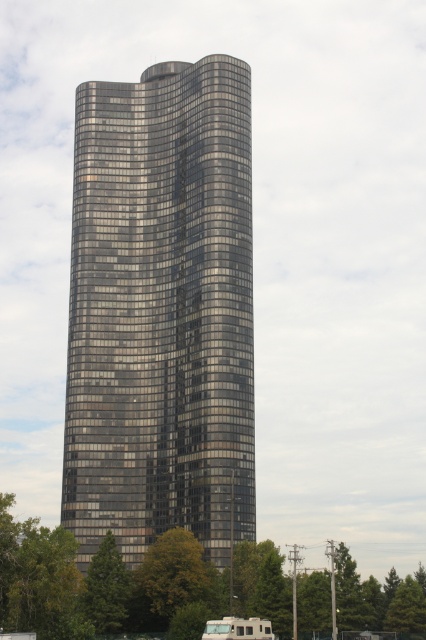
Does point (187, 474) come closer to viewer compared to point (245, 628)?

No, it is behind (245, 628).

What do you see at coordinates (161, 310) in the screenshot? I see `glossy glass tower at center` at bounding box center [161, 310].

Where is `glossy glass tower at center`? The width and height of the screenshot is (426, 640). glossy glass tower at center is located at coordinates (161, 310).